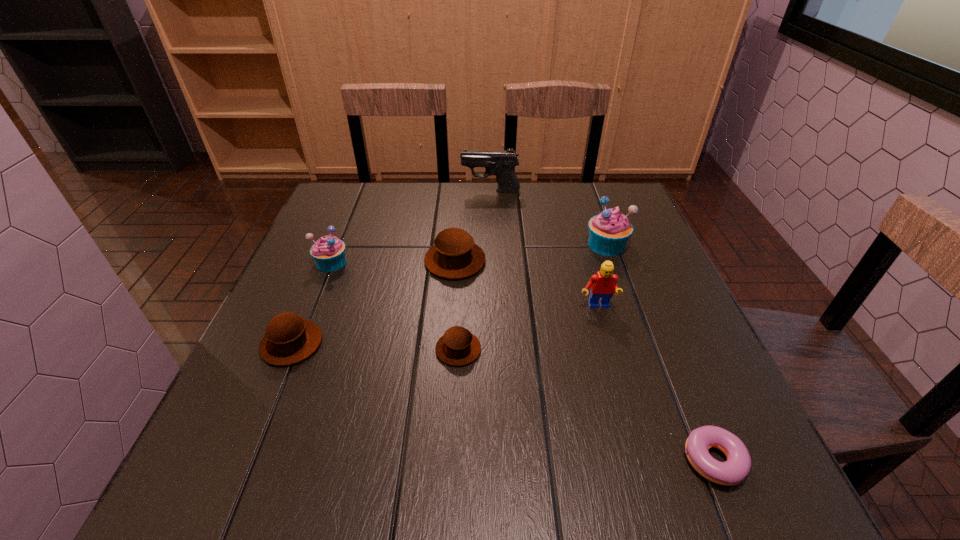
Find the location of a particular element. The image size is (960, 540). blank area located on the right of the biggest brown muffin is located at coordinates (604, 261).

I want to click on vacant space located 0.180m on the front of the leftmost brown muffin, so click(x=244, y=460).

The height and width of the screenshot is (540, 960). Find the location of `free space located on the front of the smallest brown muffin`. free space located on the front of the smallest brown muffin is located at coordinates (453, 465).

Identify the location of vacant region located on the back of the nearest object. (651, 316).

Image resolution: width=960 pixels, height=540 pixels. Find the location of `object at the far edge`. object at the far edge is located at coordinates (500, 163).

Where is `object present at the near edge`? This screenshot has width=960, height=540. object present at the near edge is located at coordinates (731, 472).

Identify the location of muffin located at the right edge. (609, 231).

Find the location of a particular element. The width and height of the screenshot is (960, 540). Lego that is at the right edge is located at coordinates (603, 284).

Where is `doughnut that is at the right edge`? doughnut that is at the right edge is located at coordinates (731, 472).

You are a GUI agent. You are given a task and a screenshot of the screen. Output one action in this format:
    pyautogui.click(x=<x>, y=<y>)
    Task: Click on the object that is at the near right corner
    The image size is (960, 540).
    Given the screenshot: What is the action you would take?
    pyautogui.click(x=731, y=472)